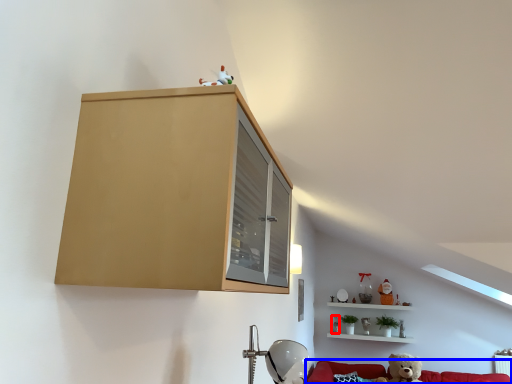
Question: Which of the following is the closest to the observer, toy (highlighted by a red box) or couch (highlighted by a blue box)?

Choices:
 (A) toy
 (B) couch

Answer: (B)